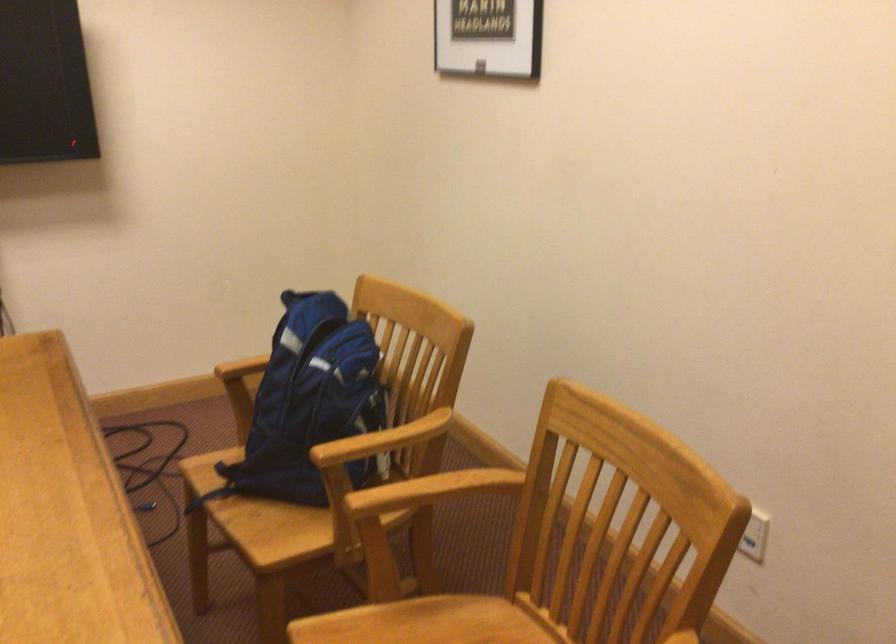
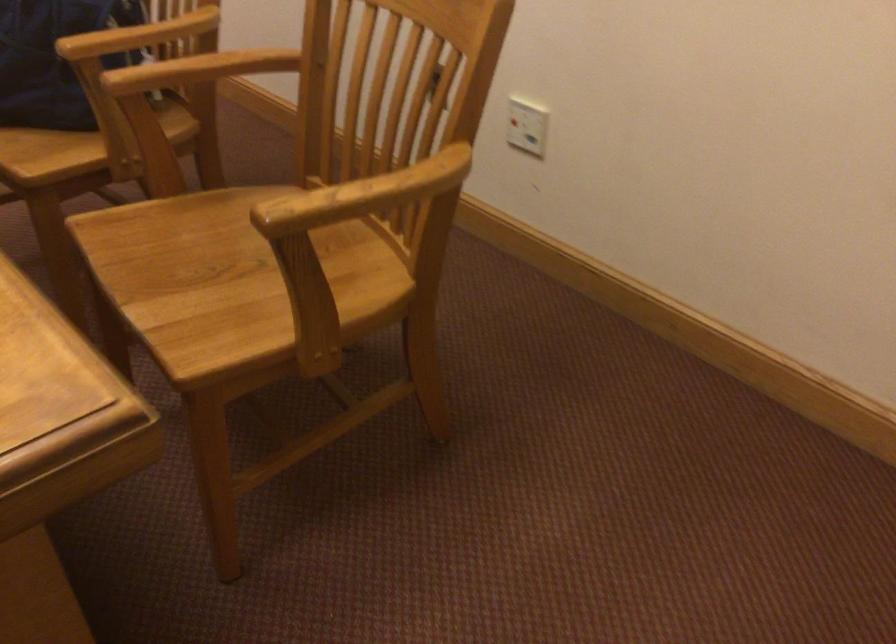
Question: What movement of the cameraman would produce the second image?

Choices:
 (A) Left
 (B) Right
 (C) Forward
 (D) Backward

Answer: (D)